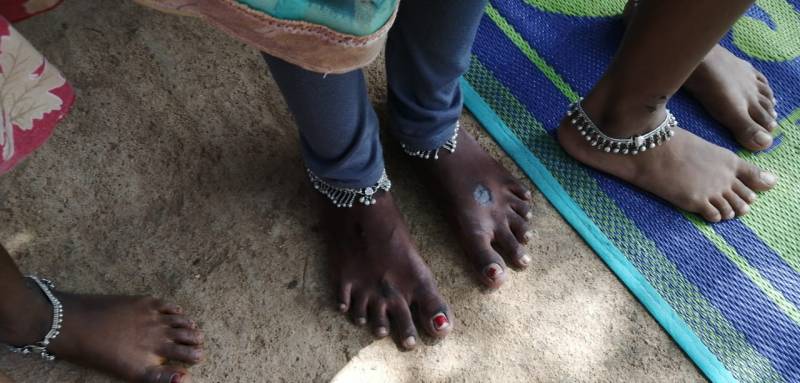
The image size is (800, 383). What are the coordinates of `hessian mat` in the screenshot? It's located at (744, 244).